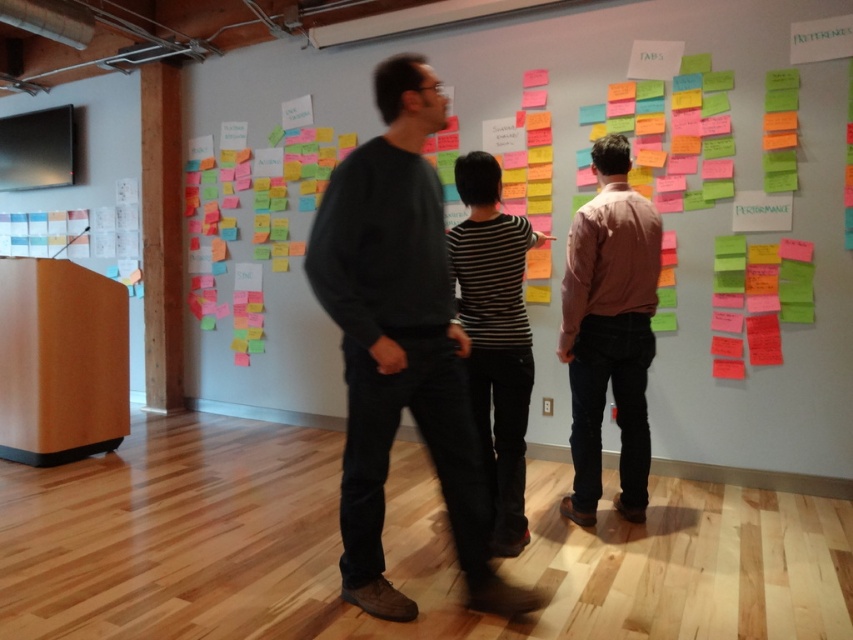
You are a new employee in the office and need to locate the PERFORMANCE section on the wall. You see the multicolored sticky notes at center and the dark gray sweater at center. Which object is closer to the PERFORMANCE section on the wall?

The multicolored sticky notes at center are positioned on the right side of the dark gray sweater at center, so the dark gray sweater at center is closer to the PERFORMANCE section on the wall.

You are a photographer in the room and want to take a photo of the pink cotton shirt at center without the multicolored sticky notes at center appearing in the background. Is this possible?

The pink cotton shirt at center is behind the multicolored sticky notes at center, so taking a photo directly facing the shirt would still show the sticky notes in front of it. To avoid the notes, you would need to position yourself so the shirt is not aligned with the notes in the background.

You are a photographer positioned at the entrance of the room. You want to take a photo that includes both point (x=331, y=330) and point (x=633, y=296). Which point should you focus on to ensure both are in sharp focus?

You should focus on point (x=331, y=330) because it is closer to the camera than point (x=633, y=296). By focusing on the closer point, the depth of field will likely include the farther point as well, ensuring both are in sharp focus.